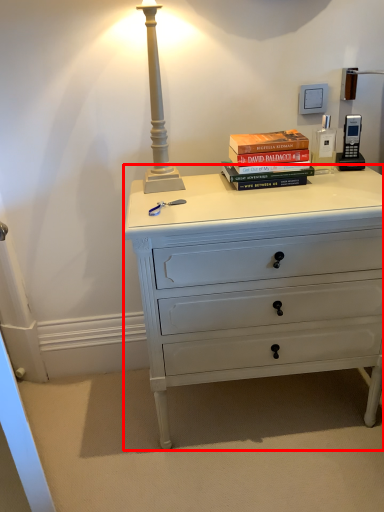
Question: Observing the image, what is the correct spatial positioning of chest of drawers (annotated by the red box) in reference to book?

Choices:
 (A) left
 (B) right

Answer: (B)